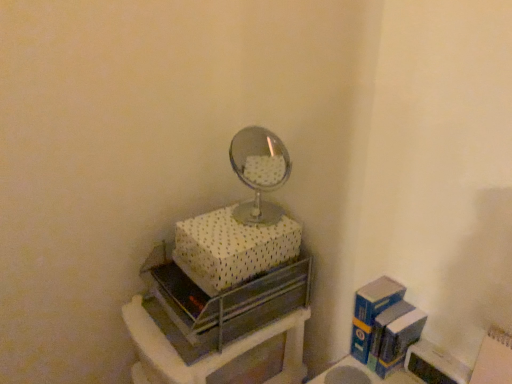
This screenshot has width=512, height=384. I want to click on vacant region above white dotted fabric box at upper center, the second box in the right-to-left sequence (from a real-world perspective), so click(234, 220).